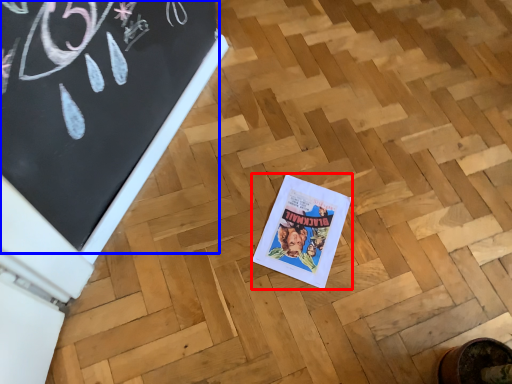
Question: Which of the following is the farthest to the observer, comic book (highlighted by a red box) or bulletin board (highlighted by a blue box)?

Choices:
 (A) comic book
 (B) bulletin board

Answer: (A)